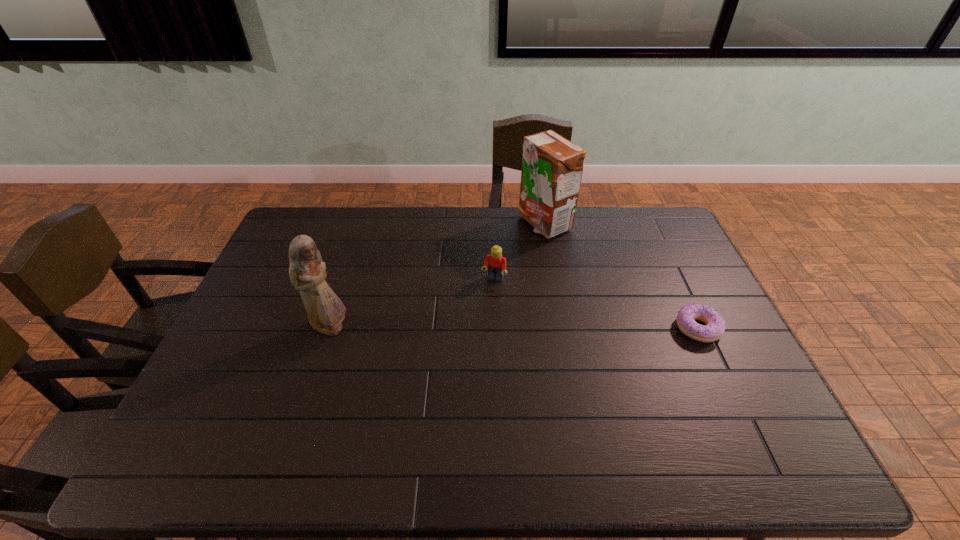
Image resolution: width=960 pixels, height=540 pixels. What are the coordinates of `the leftmost object` in the screenshot? It's located at (325, 310).

Find the location of a particular element. The width and height of the screenshot is (960, 540). the rightmost object is located at coordinates (715, 325).

Identify the location of doughnut. (715, 325).

The image size is (960, 540). Identify the location of the second object from right to left. (552, 166).

This screenshot has height=540, width=960. I want to click on carton, so click(x=552, y=166).

Image resolution: width=960 pixels, height=540 pixels. Identify the location of the second object from left to right. (x=496, y=263).

Identify the location of the second shortest object. The image size is (960, 540). (496, 263).

This screenshot has width=960, height=540. Identify the location of blank area located 0.390m on the front-facing side of the leftmost object. (486, 328).

You are a GUI agent. You are given a task and a screenshot of the screen. Output one action in this format:
    pyautogui.click(x=<x>, y=<y>)
    Task: Click on the free space located on the back of the shortest object
    
    Given the screenshot: What is the action you would take?
    click(x=681, y=293)

Where is `free space located 0.400m on the straw side of the second object from right to left`? free space located 0.400m on the straw side of the second object from right to left is located at coordinates (511, 322).